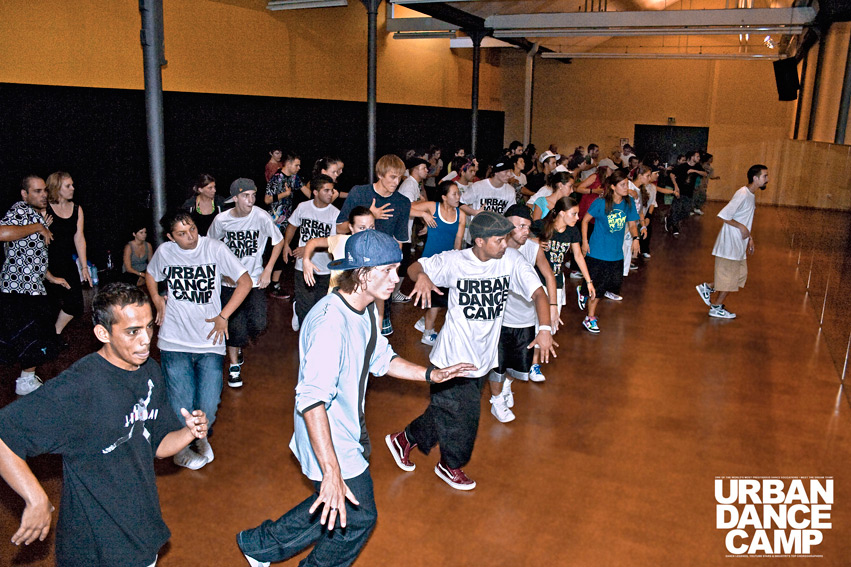
Where is `ceiling beams`? ceiling beams is located at coordinates (585, 18).